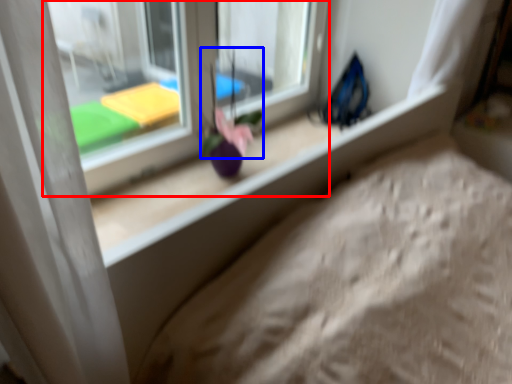
Question: Which object appears farthest to the camera in this image, window (highlighted by a red box) or flower (highlighted by a blue box)?

Choices:
 (A) window
 (B) flower

Answer: (B)